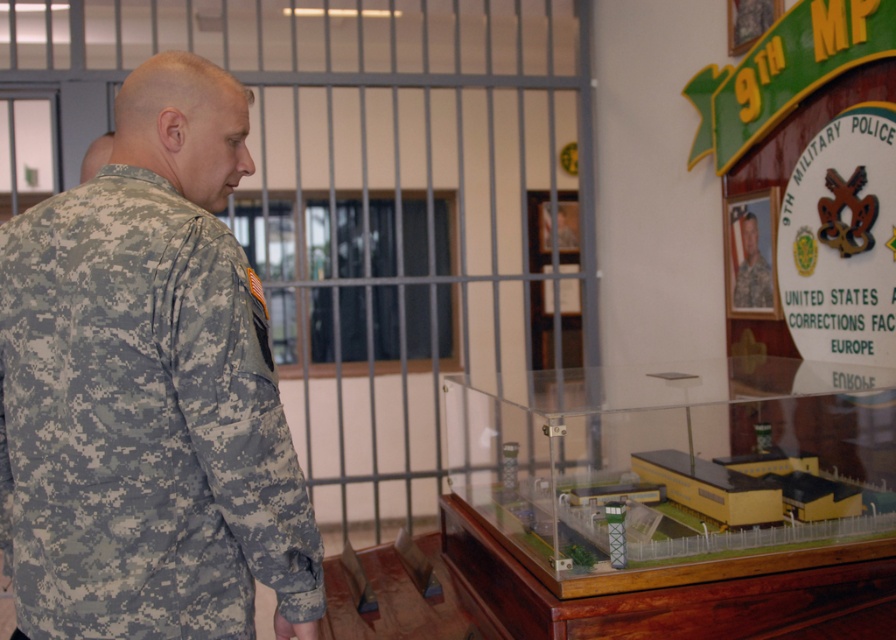
You are a security officer in the military facility. You notice two camouflage uniforms in the scene. How far apart are the camouflage uniform at left and the camouflage uniform at upper right?

The camouflage uniform at left is 5.69 feet away from the camouflage uniform at upper right.

You are a security officer in the facility. You need to check the coordinates of a point on the camouflage uniform at left. Is the point at (148, 388) located on the camouflage uniform at left?

Yes, the point at (148, 388) is located on the camouflage uniform at left according to the description.

From the picture: You are a military police officer in the scene. You need to determine which of the two points, point (162,237) or point (757,248), is closer to you. Which one is closer?

Point (162,237) is closer to the viewer than point (757,248), so the closer point is point (162,237).